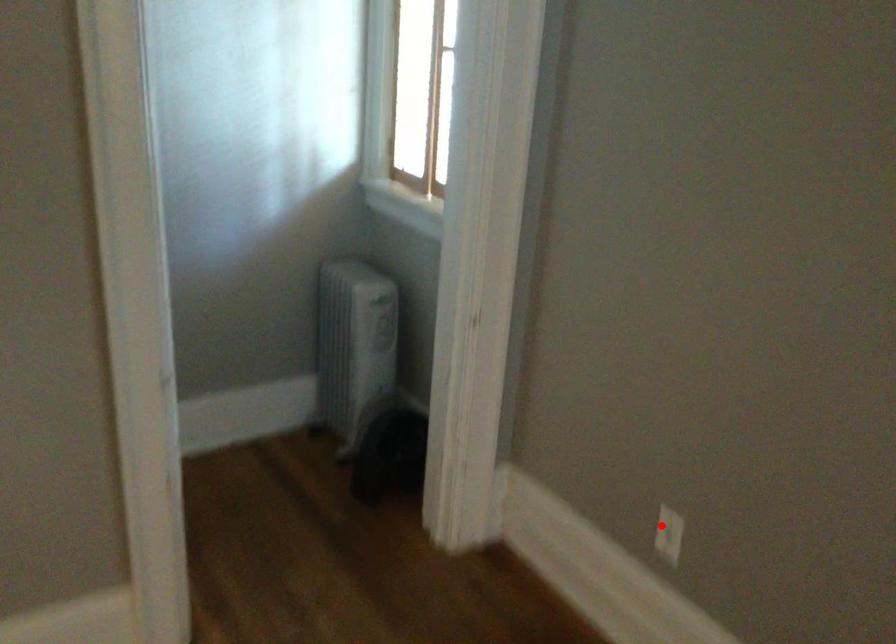
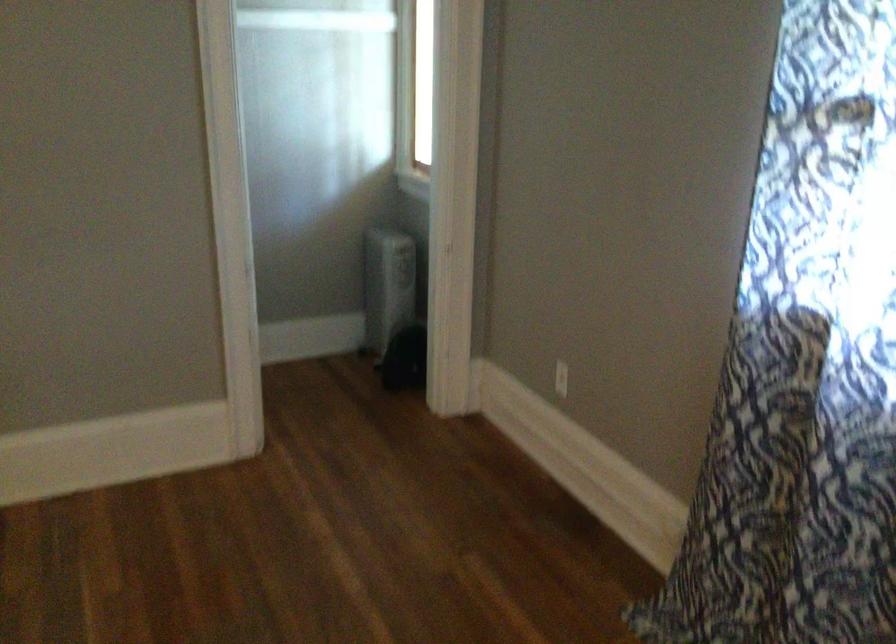
Where in the second image is the point corresponding to the highlighted location from the first image?

(561, 379)